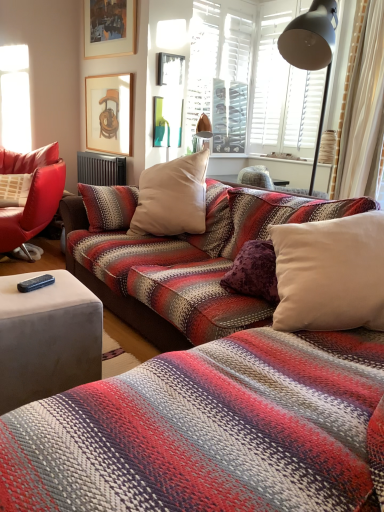
Where is `wooden picture frame at upper center, which is counted as the first picture frame, starting from the top`? The width and height of the screenshot is (384, 512). wooden picture frame at upper center, which is counted as the first picture frame, starting from the top is located at coordinates (109, 28).

I want to click on matte black picture frame at upper center, the second picture frame in the bottom-to-top sequence, so click(x=170, y=69).

How much space does matte black picture frame at upper center, which appears as the 2th picture frame when viewed from the top, occupy horizontally?

matte black picture frame at upper center, which appears as the 2th picture frame when viewed from the top, is 6.28 centimeters wide.

The image size is (384, 512). What do you see at coordinates (100, 169) in the screenshot?
I see `dark gray metallic radiator at center` at bounding box center [100, 169].

Find the location of a particular element. Image resolution: width=384 pixels, height=512 pixels. wooden framed picture at upper left, the first picture frame in the bottom-to-top sequence is located at coordinates 109,113.

Locate an element on the screen. This screenshot has height=512, width=384. wooden picture frame at upper center, which is counted as the first picture frame, starting from the top is located at coordinates (109, 28).

Based on their sizes in the image, would you say black rubber remote control at lower left is bigger or smaller than dark gray metallic radiator at center?

In the image, black rubber remote control at lower left appears to be smaller than dark gray metallic radiator at center.

Consider the image. Is the surface of black rubber remote control at lower left in direct contact with dark gray metallic radiator at center?

No, black rubber remote control at lower left is not touching dark gray metallic radiator at center.

Is point (36, 286) closer or farther from the camera than point (97, 184)?

Point (36, 286).

Who is more distant, black rubber remote control at lower left or dark gray metallic radiator at center?

dark gray metallic radiator at center is more distant.

Is black rubber remote control at lower left further to camera compared to wooden framed picture at upper left, the 3th picture frame in the top-to-bottom sequence?

No, the depth of black rubber remote control at lower left is less than that of wooden framed picture at upper left, the 3th picture frame in the top-to-bottom sequence.

From the image's perspective, is black rubber remote control at lower left beneath wooden framed picture at upper left, the 3th picture frame in the top-to-bottom sequence?

Yes, from the image's perspective, black rubber remote control at lower left is beneath wooden framed picture at upper left, the 3th picture frame in the top-to-bottom sequence.

Is black rubber remote control at lower left directly adjacent to wooden framed picture at upper left, the 3th picture frame in the top-to-bottom sequence?

No, black rubber remote control at lower left is not with wooden framed picture at upper left, the 3th picture frame in the top-to-bottom sequence.

Identify the location of remote control below the wooden framed picture at upper left, the 3th picture frame in the top-to-bottom sequence (from the image's perspective). The image size is (384, 512). (35, 283).

From the image's perspective, is wooden framed picture at upper left, the 3th picture frame in the top-to-bottom sequence, positioned above or below black rubber remote control at lower left?

wooden framed picture at upper left, the 3th picture frame in the top-to-bottom sequence, is above black rubber remote control at lower left.

Looking at this image, is wooden framed picture at upper left, the first picture frame in the bottom-to-top sequence, facing towards black rubber remote control at lower left?

No, wooden framed picture at upper left, the first picture frame in the bottom-to-top sequence, is not facing towards black rubber remote control at lower left.

From a real-world perspective, which is physically above, wooden framed picture at upper left, the first picture frame in the bottom-to-top sequence, or black rubber remote control at lower left?

wooden framed picture at upper left, the first picture frame in the bottom-to-top sequence.

Considering the relative sizes of wooden framed picture at upper left, the first picture frame in the bottom-to-top sequence, and black rubber remote control at lower left in the image provided, is wooden framed picture at upper left, the first picture frame in the bottom-to-top sequence, thinner than black rubber remote control at lower left?

Yes.

Which object is further away from the camera taking this photo, wooden framed picture at upper left, the first picture frame in the bottom-to-top sequence, or dark gray metallic radiator at center?

dark gray metallic radiator at center is further away from the camera.

Is wooden framed picture at upper left, the first picture frame in the bottom-to-top sequence, directly adjacent to dark gray metallic radiator at center?

Result: There is a gap between wooden framed picture at upper left, the first picture frame in the bottom-to-top sequence, and dark gray metallic radiator at center.

Does point (127, 96) appear closer or farther from the camera than point (100, 163)?

Point (127, 96) is positioned closer to the camera compared to point (100, 163).

What's the angular difference between wooden framed picture at upper left, the first picture frame in the bottom-to-top sequence, and dark gray metallic radiator at center's facing directions?

The angle between the facing direction of wooden framed picture at upper left, the first picture frame in the bottom-to-top sequence, and the facing direction of dark gray metallic radiator at center is 0.0083 degrees.

Does dark gray metallic radiator at center have a smaller size compared to matte black picture frame at upper center, the second picture frame in the bottom-to-top sequence?

No, dark gray metallic radiator at center is not smaller than matte black picture frame at upper center, the second picture frame in the bottom-to-top sequence.

Is dark gray metallic radiator at center shorter than matte black picture frame at upper center, the second picture frame in the bottom-to-top sequence?

In fact, dark gray metallic radiator at center may be taller than matte black picture frame at upper center, the second picture frame in the bottom-to-top sequence.

Does dark gray metallic radiator at center have a lesser width compared to matte black picture frame at upper center, the second picture frame in the bottom-to-top sequence?

No.

From a real-world perspective, is velvet gray studio couch at lower left physically below wooden picture frame at upper center, which is counted as the first picture frame, starting from the top?

Yes, from a real-world perspective, velvet gray studio couch at lower left is below wooden picture frame at upper center, which is counted as the first picture frame, starting from the top.

Who is taller, velvet gray studio couch at lower left or wooden picture frame at upper center, marked as the 3th picture frame in a bottom-to-top arrangement?

With more height is wooden picture frame at upper center, marked as the 3th picture frame in a bottom-to-top arrangement.

Looking at this image, which object is further away from the camera, velvet gray studio couch at lower left or wooden picture frame at upper center, marked as the 3th picture frame in a bottom-to-top arrangement?

wooden picture frame at upper center, marked as the 3th picture frame in a bottom-to-top arrangement, is further away from the camera.

Which of these two, velvet gray studio couch at lower left or wooden picture frame at upper center, marked as the 3th picture frame in a bottom-to-top arrangement, is smaller?

wooden picture frame at upper center, marked as the 3th picture frame in a bottom-to-top arrangement.

Is dark gray metallic radiator at center situated inside black rubber remote control at lower left or outside?

dark gray metallic radiator at center cannot be found inside black rubber remote control at lower left.

Does point (102, 169) lie behind point (24, 289)?

That is True.

Which object is closer to the camera taking this photo, dark gray metallic radiator at center or black rubber remote control at lower left?

Positioned in front is black rubber remote control at lower left.

Where is `radiator above the black rubber remote control at lower left (from the image's perspective)`? This screenshot has width=384, height=512. radiator above the black rubber remote control at lower left (from the image's perspective) is located at coordinates (100, 169).

I want to click on the 3rd picture frame behind the black rubber remote control at lower left, so click(109, 113).

Which object lies nearer to the anchor point wooden picture frame at upper center, which is counted as the first picture frame, starting from the top, dark gray metallic radiator at center or velvet gray studio couch at lower left?

Among the two, dark gray metallic radiator at center is located nearer to wooden picture frame at upper center, which is counted as the first picture frame, starting from the top.

Looking at the image, which one is located closer to velvet gray studio couch at lower left, black rubber remote control at lower left or wooden framed picture at upper left, the first picture frame in the bottom-to-top sequence?

black rubber remote control at lower left is positioned closer to the anchor velvet gray studio couch at lower left.

Estimate the real-world distances between objects in this image. Which object is closer to wooden picture frame at upper center, marked as the 3th picture frame in a bottom-to-top arrangement, black rubber remote control at lower left or matte black picture frame at upper center, which appears as the 2th picture frame when viewed from the top?

matte black picture frame at upper center, which appears as the 2th picture frame when viewed from the top.

Considering their positions, is black rubber remote control at lower left positioned closer to wooden framed picture at upper left, the 3th picture frame in the top-to-bottom sequence, than velvet gray studio couch at lower left?

velvet gray studio couch at lower left is positioned closer to the anchor wooden framed picture at upper left, the 3th picture frame in the top-to-bottom sequence.

Looking at this image, which object lies nearer to the anchor point dark gray metallic radiator at center, matte black picture frame at upper center, the second picture frame in the bottom-to-top sequence, or wooden framed picture at upper left, the first picture frame in the bottom-to-top sequence?

wooden framed picture at upper left, the first picture frame in the bottom-to-top sequence.

When comparing their distances from velvet gray studio couch at lower left, does matte black picture frame at upper center, which appears as the 2th picture frame when viewed from the top, or black rubber remote control at lower left seem further?

matte black picture frame at upper center, which appears as the 2th picture frame when viewed from the top, lies further to velvet gray studio couch at lower left than the other object.

From the picture: Estimate the real-world distances between objects in this image. Which object is closer to dark gray metallic radiator at center, wooden framed picture at upper left, the first picture frame in the bottom-to-top sequence, or velvet gray studio couch at lower left?

wooden framed picture at upper left, the first picture frame in the bottom-to-top sequence, lies closer to dark gray metallic radiator at center than the other object.

Based on their spatial positions, is velvet gray studio couch at lower left or matte black picture frame at upper center, the second picture frame in the bottom-to-top sequence, further from wooden framed picture at upper left, the 3th picture frame in the top-to-bottom sequence?

velvet gray studio couch at lower left lies further to wooden framed picture at upper left, the 3th picture frame in the top-to-bottom sequence, than the other object.

You are a GUI agent. You are given a task and a screenshot of the screen. Output one action in this format:
    pyautogui.click(x=<x>, y=<y>)
    Task: Click on the picture frame between matte black picture frame at upper center, which appears as the 2th picture frame when viewed from the top, and dark gray metallic radiator at center, in the vertical direction
    The height and width of the screenshot is (512, 384).
    Given the screenshot: What is the action you would take?
    pyautogui.click(x=109, y=113)

Where is `remote control between velvet gray studio couch at lower left and matte black picture frame at upper center, the second picture frame in the bottom-to-top sequence, from front to back`? remote control between velvet gray studio couch at lower left and matte black picture frame at upper center, the second picture frame in the bottom-to-top sequence, from front to back is located at coordinates (35, 283).

Find the location of `picture frame between wooden picture frame at upper center, marked as the 3th picture frame in a bottom-to-top arrangement, and wooden framed picture at upper left, the 3th picture frame in the top-to-bottom sequence, in the vertical direction`. picture frame between wooden picture frame at upper center, marked as the 3th picture frame in a bottom-to-top arrangement, and wooden framed picture at upper left, the 3th picture frame in the top-to-bottom sequence, in the vertical direction is located at coordinates (170, 69).

This screenshot has height=512, width=384. What are the coordinates of `remote control positioned between velvet gray studio couch at lower left and wooden framed picture at upper left, the 3th picture frame in the top-to-bottom sequence, from near to far` in the screenshot? It's located at (35, 283).